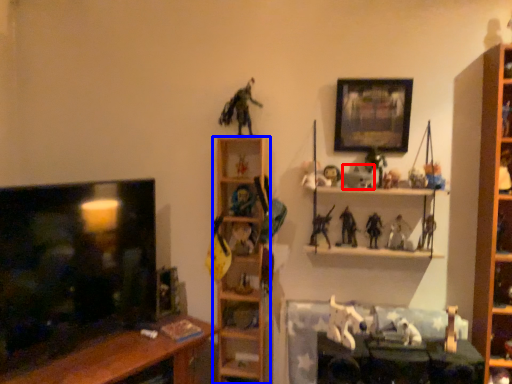
Question: Which point is closer to the camera, toy (highlighted by a red box) or shelf (highlighted by a blue box)?

Choices:
 (A) toy
 (B) shelf

Answer: (A)